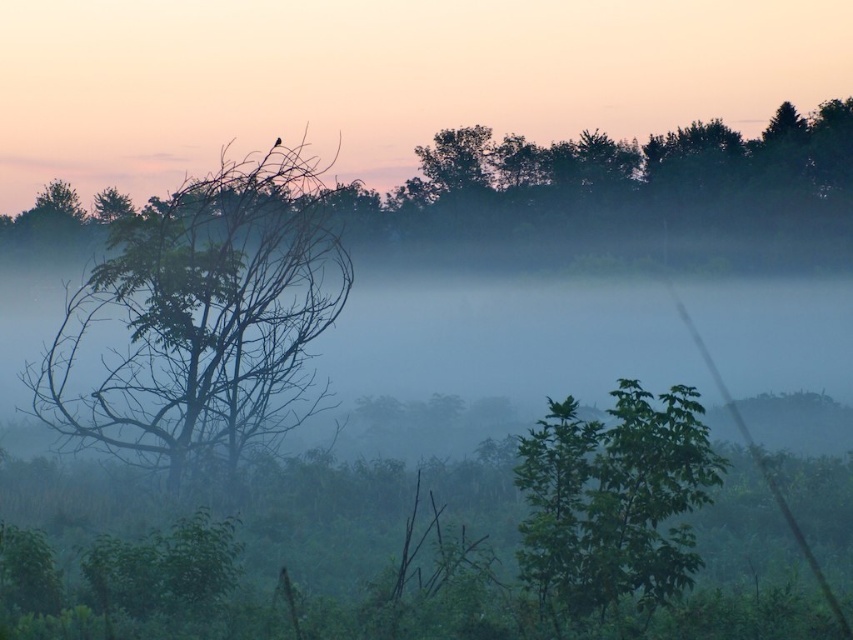
Question: Observing the image, what is the correct spatial positioning of green leafy tree at upper center in reference to silvery metallic bird at upper center?

Choices:
 (A) above
 (B) below

Answer: (B)

Question: Is silhouetted tree at left positioned before green matte tree at left?

Choices:
 (A) yes
 (B) no

Answer: (B)

Question: Which object is closer to the camera taking this photo?

Choices:
 (A) silvery metallic bird at upper center
 (B) silhouetted tree at left
 (C) green matte tree at left
 (D) green leafy tree at upper center

Answer: (C)

Question: Which object is closer to the camera taking this photo?

Choices:
 (A) green matte tree at left
 (B) green leafy tree at center
 (C) green leafy tree at upper center
 (D) silvery metallic bird at upper center

Answer: (B)

Question: Which object is the farthest from the green leafy tree at center?

Choices:
 (A) silvery metallic bird at upper center
 (B) green leafy tree at upper center
 (C) green matte tree at left

Answer: (A)

Question: Is green matte tree at left wider than green leafy tree at center?

Choices:
 (A) no
 (B) yes

Answer: (B)